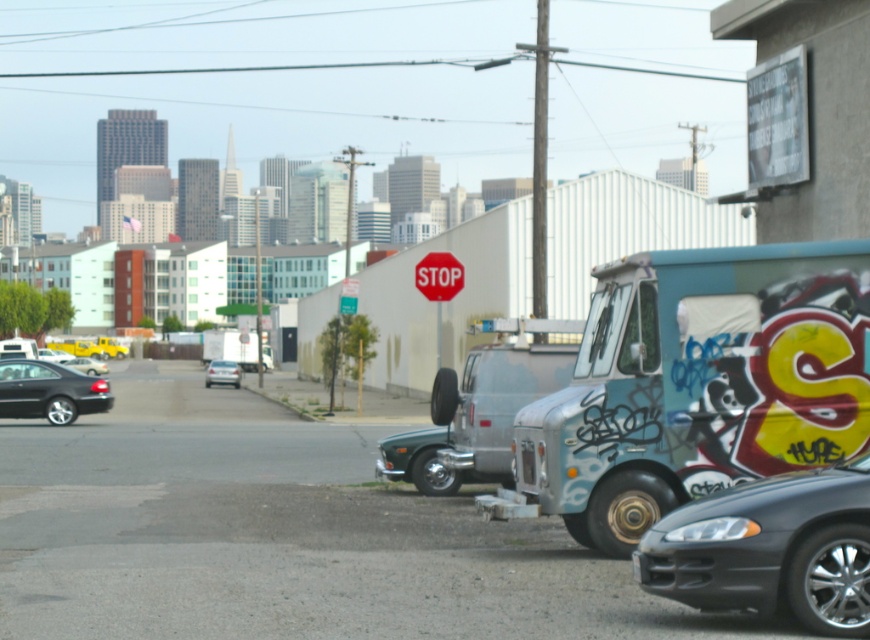
Can you confirm if shiny black sedan at center is smaller than shiny black sedan at center-left?

No.

Does point (104, 364) come behind point (39, 352)?

Yes, it is.

At what (x,y) coordinates should I click in order to perform the action: click on shiny black sedan at center. Please return your answer as a coordinate pair (x, y). The width and height of the screenshot is (870, 640). Looking at the image, I should click on (87, 365).

Where is `shiny black car at lower right`? The width and height of the screenshot is (870, 640). shiny black car at lower right is located at coordinates (770, 548).

This screenshot has width=870, height=640. I want to click on shiny black car at lower right, so click(x=770, y=548).

Between point (219, 360) and point (88, 358), which one is positioned behind?

The point (88, 358) is behind.

This screenshot has width=870, height=640. Find the location of `silver metallic sedan at center`. silver metallic sedan at center is located at coordinates (222, 372).